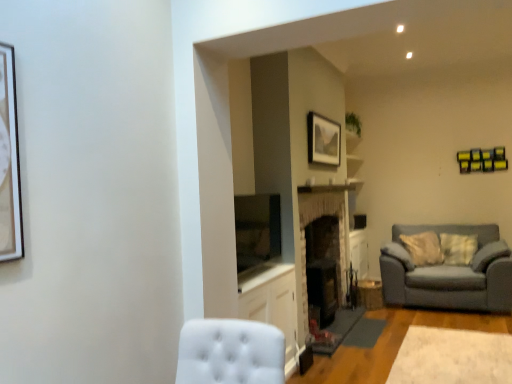
Question: Which direction should I rotate to look at dark stone fireplace at center, which is the first fireplace in back-to-front order?

Choices:
 (A) left
 (B) right

Answer: (B)

Question: Are dark stone fireplace at center, which is the first fireplace in back-to-front order, and gray fabric couch at right far apart?

Choices:
 (A) yes
 (B) no

Answer: (A)

Question: Is gray fabric couch at right at the back of dark stone fireplace at center, which is the first fireplace in back-to-front order?

Choices:
 (A) no
 (B) yes

Answer: (A)

Question: From a real-world perspective, is dark stone fireplace at center, which is the first fireplace in back-to-front order, positioned under gray fabric couch at right based on gravity?

Choices:
 (A) yes
 (B) no

Answer: (B)

Question: Is dark stone fireplace at center, which is the first fireplace in back-to-front order, smaller than gray fabric couch at right?

Choices:
 (A) no
 (B) yes

Answer: (B)

Question: Considering the relative sizes of dark stone fireplace at center, which is the first fireplace in back-to-front order, and gray fabric couch at right in the image provided, is dark stone fireplace at center, which is the first fireplace in back-to-front order, shorter than gray fabric couch at right?

Choices:
 (A) no
 (B) yes

Answer: (A)

Question: Is dark stone fireplace at center, placed as the 2th fireplace when sorted from front to back, further to the viewer compared to gray fabric couch at right?

Choices:
 (A) no
 (B) yes

Answer: (A)

Question: From a real-world perspective, is gray fabric couch at right positioned over white plush rug at lower right based on gravity?

Choices:
 (A) yes
 (B) no

Answer: (A)

Question: Is white plush rug at lower right at the back of gray fabric couch at right?

Choices:
 (A) no
 (B) yes

Answer: (A)

Question: Can white plush rug at lower right be found inside gray fabric couch at right?

Choices:
 (A) no
 (B) yes

Answer: (A)

Question: Considering the relative sizes of gray fabric couch at right and white plush rug at lower right in the image provided, is gray fabric couch at right smaller than white plush rug at lower right?

Choices:
 (A) yes
 (B) no

Answer: (B)

Question: Can you confirm if gray fabric couch at right is wider than white plush rug at lower right?

Choices:
 (A) no
 (B) yes

Answer: (B)

Question: Are gray fabric couch at right and white plush rug at lower right far apart?

Choices:
 (A) yes
 (B) no

Answer: (A)

Question: Can you confirm if white plush rug at lower right is positioned to the right of matte wooden picture frame at upper center?

Choices:
 (A) yes
 (B) no

Answer: (A)